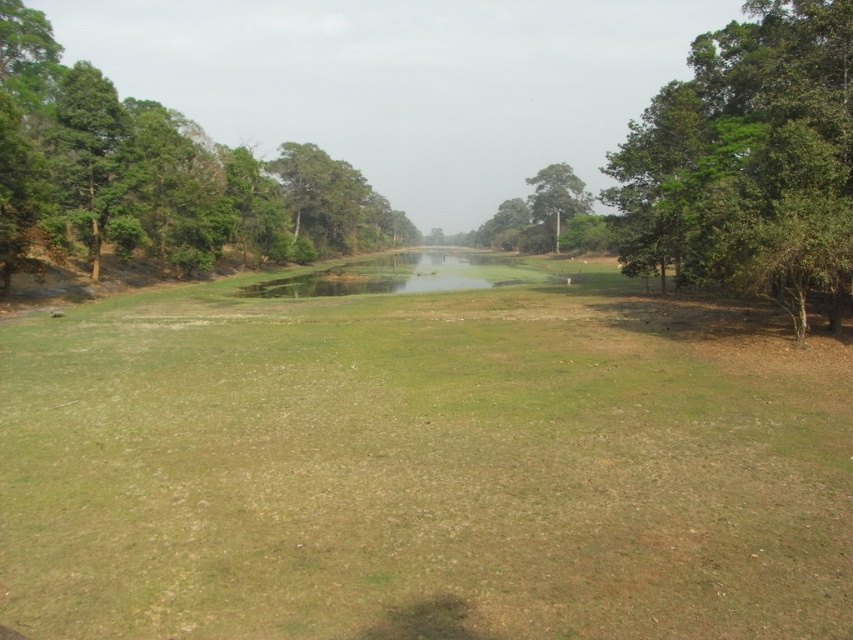
You are standing at the point labeled as point (422, 464) in the image. Looking around, you see the green grassy field at center. Which direction should you walk to reach the dense trees on the left side of the image?

The dense trees on the left side of the image are located to the left of the green grassy field at center. Since you are standing at the point where the green grassy field at center is, you should walk towards the left to reach the dense trees on the left side of the image.

You are standing in the middle of the green grassy field at center and want to reach the green leafy tree at right. Which direction should you walk to get closer to the tree?

You should walk towards the right direction since the green leafy tree at right is located to the right side of the green grassy field at center.